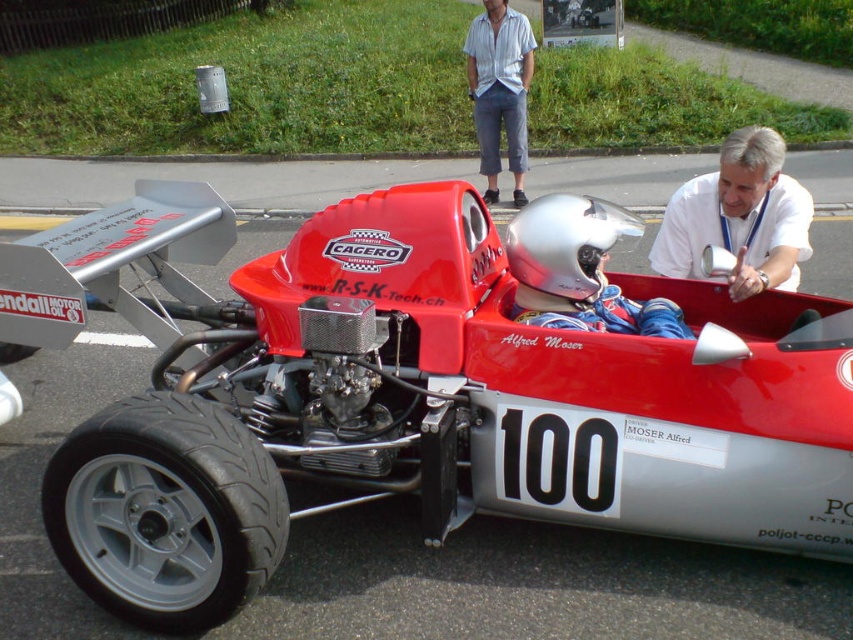
Question: Does shiny red race car at center have a larger size compared to white lanyard at upper center?

Choices:
 (A) yes
 (B) no

Answer: (A)

Question: Estimate the real-world distances between objects in this image. Which object is closer to the shiny red race car at center?

Choices:
 (A) light blue cotton shirt at upper center
 (B) white lanyard at upper center

Answer: (B)

Question: Does shiny red race car at center lie in front of white lanyard at upper center?

Choices:
 (A) yes
 (B) no

Answer: (A)

Question: Is white lanyard at upper center wider than light blue cotton shirt at upper center?

Choices:
 (A) no
 (B) yes

Answer: (A)

Question: Which object is positioned farthest from the shiny red race car at center?

Choices:
 (A) white lanyard at upper center
 (B) silver metallic helmet at center
 (C) light blue cotton shirt at upper center

Answer: (C)

Question: Which object is closer to the camera taking this photo?

Choices:
 (A) silver metallic helmet at center
 (B) white lanyard at upper center
 (C) light blue cotton shirt at upper center

Answer: (A)